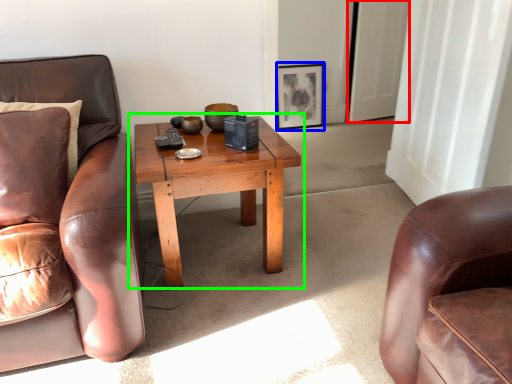
Question: Based on their relative distances, which object is farther from glass door (highlighted by a red box)? Choose from picture frame (highlighted by a blue box) and coffee table (highlighted by a green box).

Choices:
 (A) picture frame
 (B) coffee table

Answer: (B)